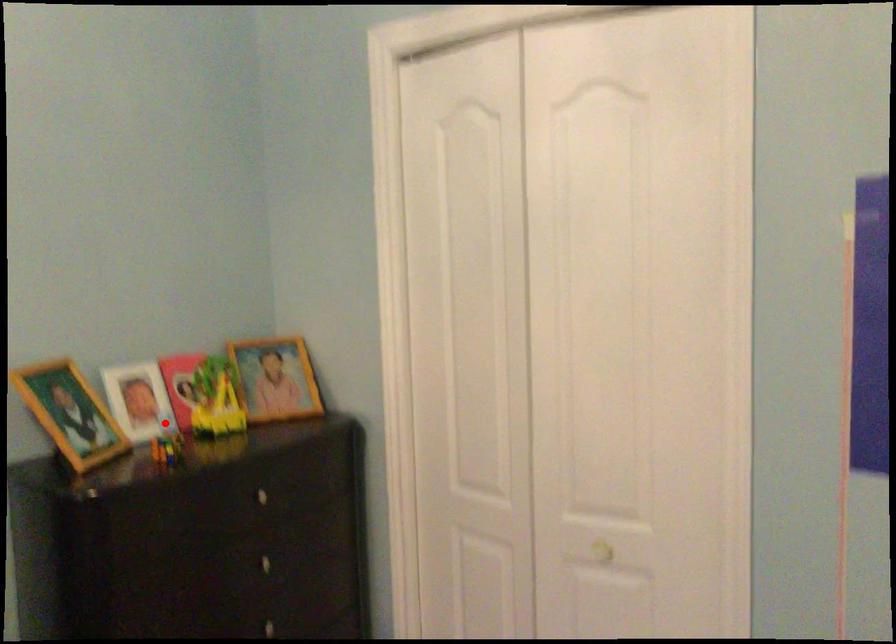
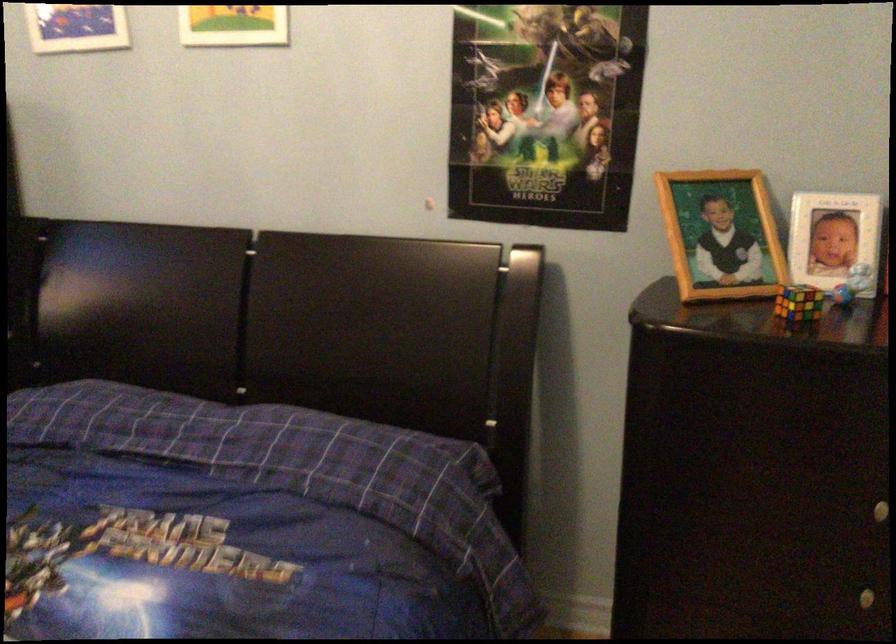
In the second image, find the point that corresponds to the highlighted location in the first image.

(851, 283)